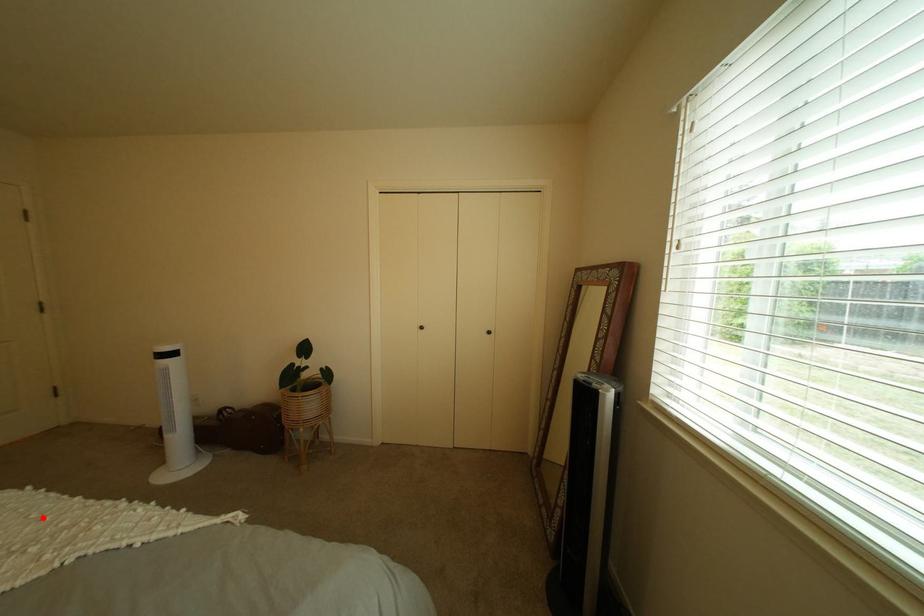
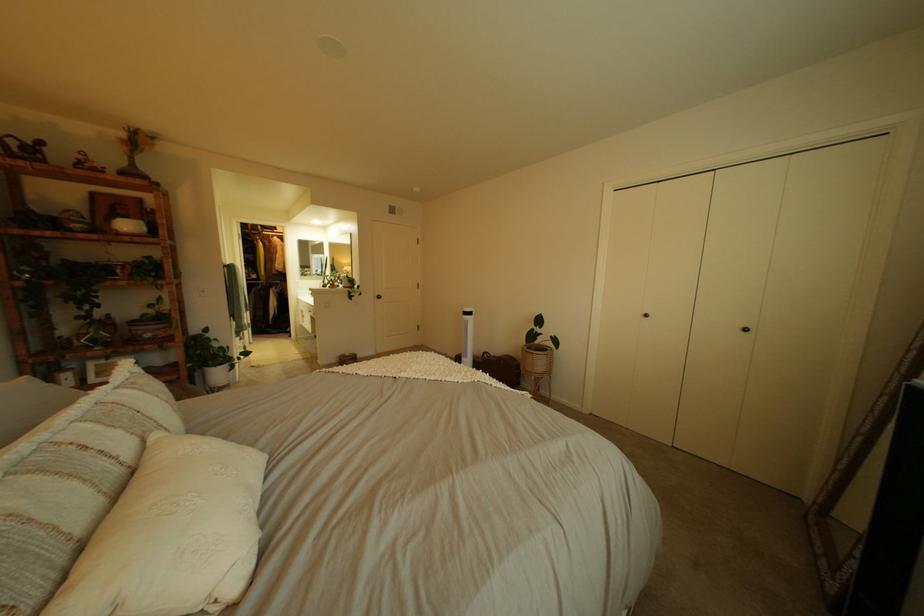
The point at the highlighted location is marked in the first image. Where is the corresponding point in the second image?

(468, 365)